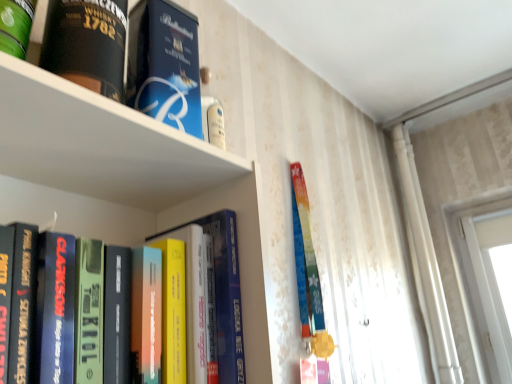
This screenshot has width=512, height=384. What do you see at coordinates (164, 65) in the screenshot? I see `blue cardboard box at upper center, positioned as the second book in bottom-to-top order` at bounding box center [164, 65].

Describe the element at coordinates (130, 56) in the screenshot. I see `black matte whiskey bottle at upper left, which is counted as the second book, starting from the top` at that location.

This screenshot has height=384, width=512. Describe the element at coordinates (16, 26) in the screenshot. I see `green matte canister at upper left, which appears as the 1th book when viewed from the top` at that location.

The width and height of the screenshot is (512, 384). Identify the location of green matte canister at upper left, which appears as the 1th book when viewed from the top. (16, 26).

Identify the location of blue cardboard box at upper center, placed as the third book when sorted from top to bottom. (164, 65).

Which object is closer to the camera, green matte canister at upper left, which is counted as the 4th book, starting from the bottom, or hardcover book at left, marked as the first book in a bottom-to-top arrangement?

hardcover book at left, marked as the first book in a bottom-to-top arrangement.

Between green matte canister at upper left, which appears as the 1th book when viewed from the top, and hardcover book at left, arranged as the fourth book when viewed from the top, which one has larger width?

Wider between the two is hardcover book at left, arranged as the fourth book when viewed from the top.

Visually, is green matte canister at upper left, which is counted as the 4th book, starting from the bottom, positioned to the left or to the right of hardcover book at left, marked as the first book in a bottom-to-top arrangement?

In the image, green matte canister at upper left, which is counted as the 4th book, starting from the bottom, appears on the left side of hardcover book at left, marked as the first book in a bottom-to-top arrangement.

Is green matte canister at upper left, which appears as the 1th book when viewed from the top, looking in the opposite direction of hardcover book at left, arranged as the fourth book when viewed from the top?

green matte canister at upper left, which appears as the 1th book when viewed from the top, does not have its back to hardcover book at left, arranged as the fourth book when viewed from the top.

Is blue cardboard box at upper center, positioned as the second book in bottom-to-top order, inside or outside of green matte canister at upper left, which appears as the 1th book when viewed from the top?

blue cardboard box at upper center, positioned as the second book in bottom-to-top order, is not inside green matte canister at upper left, which appears as the 1th book when viewed from the top, it's outside.

Who is taller, blue cardboard box at upper center, positioned as the second book in bottom-to-top order, or green matte canister at upper left, which appears as the 1th book when viewed from the top?

green matte canister at upper left, which appears as the 1th book when viewed from the top.

Would you say blue cardboard box at upper center, placed as the third book when sorted from top to bottom, is a long distance from green matte canister at upper left, which appears as the 1th book when viewed from the top?

They are positioned close to each other.

What's the angular difference between blue cardboard box at upper center, positioned as the second book in bottom-to-top order, and green matte canister at upper left, which is counted as the 4th book, starting from the bottom,'s facing directions?

2.79 degrees separate the facing orientations of blue cardboard box at upper center, positioned as the second book in bottom-to-top order, and green matte canister at upper left, which is counted as the 4th book, starting from the bottom.

From the image's perspective, count 3rd books downward from the green matte canister at upper left, which is counted as the 4th book, starting from the bottom, and point to it. Please provide its 2D coordinates.

[(89, 309)]

Which object is further away from the camera taking this photo, hardcover book at left, marked as the first book in a bottom-to-top arrangement, or green matte canister at upper left, which is counted as the 4th book, starting from the bottom?

Positioned behind is green matte canister at upper left, which is counted as the 4th book, starting from the bottom.

From a real-world perspective, who is located lower, hardcover book at left, arranged as the fourth book when viewed from the top, or green matte canister at upper left, which is counted as the 4th book, starting from the bottom?

From a 3D spatial view, hardcover book at left, arranged as the fourth book when viewed from the top, is below.

Based on the photo, from the image's perspective, relative to green matte canister at upper left, which appears as the 1th book when viewed from the top, is hardcover book at left, marked as the first book in a bottom-to-top arrangement, above or below?

Clearly, from the image's perspective, hardcover book at left, marked as the first book in a bottom-to-top arrangement, is below green matte canister at upper left, which appears as the 1th book when viewed from the top.

Does point (69, 240) appear closer or farther from the camera than point (176, 31)?

Clearly, point (69, 240) is closer to the camera than point (176, 31).

Could you tell me if hardcover book at left, arranged as the fourth book when viewed from the top, is facing blue cardboard box at upper center, placed as the third book when sorted from top to bottom?

No, hardcover book at left, arranged as the fourth book when viewed from the top, is not aimed at blue cardboard box at upper center, placed as the third book when sorted from top to bottom.

The image size is (512, 384). What are the coordinates of `book that is the 2nd one below the blue cardboard box at upper center, placed as the third book when sorted from top to bottom (from a real-world perspective)` in the screenshot? It's located at (89, 309).

Which is nearer, (1, 29) or (198, 70)?

Clearly, point (1, 29) is closer to the camera than point (198, 70).

From a real-world perspective, between green matte canister at upper left, which is counted as the 4th book, starting from the bottom, and blue cardboard box at upper center, placed as the third book when sorted from top to bottom, who is vertically lower?

From a 3D spatial view, blue cardboard box at upper center, placed as the third book when sorted from top to bottom, is below.

Is green matte canister at upper left, which appears as the 1th book when viewed from the top, shorter than blue cardboard box at upper center, placed as the third book when sorted from top to bottom?

No.

Considering their positions, is blue cardboard box at upper center, placed as the third book when sorted from top to bottom, located in front of or behind black matte whiskey bottle at upper left, which is the 3th book from bottom to top?

In the image, blue cardboard box at upper center, placed as the third book when sorted from top to bottom, appears behind black matte whiskey bottle at upper left, which is the 3th book from bottom to top.

Considering the sizes of blue cardboard box at upper center, positioned as the second book in bottom-to-top order, and black matte whiskey bottle at upper left, which is counted as the second book, starting from the top, in the image, is blue cardboard box at upper center, positioned as the second book in bottom-to-top order, bigger or smaller than black matte whiskey bottle at upper left, which is counted as the second book, starting from the top,?

blue cardboard box at upper center, positioned as the second book in bottom-to-top order, is smaller than black matte whiskey bottle at upper left, which is counted as the second book, starting from the top.

Based on the photo, between blue cardboard box at upper center, placed as the third book when sorted from top to bottom, and black matte whiskey bottle at upper left, which is counted as the second book, starting from the top, which one appears on the right side from the viewer's perspective?

blue cardboard box at upper center, placed as the third book when sorted from top to bottom.

Does blue cardboard box at upper center, placed as the third book when sorted from top to bottom, have a lesser width compared to black matte whiskey bottle at upper left, which is the 3th book from bottom to top?

Yes, blue cardboard box at upper center, placed as the third book when sorted from top to bottom, is thinner than black matte whiskey bottle at upper left, which is the 3th book from bottom to top.

Which object is further away from the camera taking this photo, green matte canister at upper left, which appears as the 1th book when viewed from the top, or black matte whiskey bottle at upper left, which is counted as the second book, starting from the top?

black matte whiskey bottle at upper left, which is counted as the second book, starting from the top, is behind.

Is green matte canister at upper left, which is counted as the 4th book, starting from the bottom, positioned with its back to black matte whiskey bottle at upper left, which is counted as the second book, starting from the top?

No, green matte canister at upper left, which is counted as the 4th book, starting from the bottom, is not facing the opposite direction of black matte whiskey bottle at upper left, which is counted as the second book, starting from the top.

Is green matte canister at upper left, which is counted as the 4th book, starting from the bottom, completely or partially outside of black matte whiskey bottle at upper left, which is the 3th book from bottom to top?

Yes, green matte canister at upper left, which is counted as the 4th book, starting from the bottom, is located beyond the bounds of black matte whiskey bottle at upper left, which is the 3th book from bottom to top.

Considering the relative sizes of green matte canister at upper left, which is counted as the 4th book, starting from the bottom, and black matte whiskey bottle at upper left, which is counted as the second book, starting from the top, in the image provided, is green matte canister at upper left, which is counted as the 4th book, starting from the bottom, wider than black matte whiskey bottle at upper left, which is counted as the second book, starting from the top,?

No.

Identify the location of book that is the 2nd object to the right of the green matte canister at upper left, which appears as the 1th book when viewed from the top, starting at the anchor. (89, 309).

There is a blue cardboard box at upper center, positioned as the second book in bottom-to-top order. What are the coordinates of `the 2nd book above it (from the image's perspective)` in the screenshot? It's located at (16, 26).

Estimate the real-world distances between objects in this image. Which object is closer to black matte whiskey bottle at upper left, which is counted as the second book, starting from the top, blue cardboard box at upper center, placed as the third book when sorted from top to bottom, or green matte canister at upper left, which is counted as the 4th book, starting from the bottom?

The object closer to black matte whiskey bottle at upper left, which is counted as the second book, starting from the top, is blue cardboard box at upper center, placed as the third book when sorted from top to bottom.

From the image, which object appears to be nearer to hardcover book at left, arranged as the fourth book when viewed from the top, green matte canister at upper left, which appears as the 1th book when viewed from the top, or black matte whiskey bottle at upper left, which is counted as the second book, starting from the top?

Among the two, black matte whiskey bottle at upper left, which is counted as the second book, starting from the top, is located nearer to hardcover book at left, arranged as the fourth book when viewed from the top.

When comparing their distances from blue cardboard box at upper center, positioned as the second book in bottom-to-top order, does black matte whiskey bottle at upper left, which is counted as the second book, starting from the top, or green matte canister at upper left, which is counted as the 4th book, starting from the bottom, seem further?

green matte canister at upper left, which is counted as the 4th book, starting from the bottom, is further to blue cardboard box at upper center, positioned as the second book in bottom-to-top order.

From the image, which object appears to be nearer to hardcover book at left, marked as the first book in a bottom-to-top arrangement, black matte whiskey bottle at upper left, which is counted as the second book, starting from the top, or green matte canister at upper left, which is counted as the 4th book, starting from the bottom?

black matte whiskey bottle at upper left, which is counted as the second book, starting from the top, lies closer to hardcover book at left, marked as the first book in a bottom-to-top arrangement, than the other object.

Based on their spatial positions, is green matte canister at upper left, which appears as the 1th book when viewed from the top, or blue cardboard box at upper center, placed as the third book when sorted from top to bottom, further from black matte whiskey bottle at upper left, which is the 3th book from bottom to top?

The object further to black matte whiskey bottle at upper left, which is the 3th book from bottom to top, is green matte canister at upper left, which appears as the 1th book when viewed from the top.

From the image, which object appears to be farther from hardcover book at left, marked as the first book in a bottom-to-top arrangement, blue cardboard box at upper center, placed as the third book when sorted from top to bottom, or black matte whiskey bottle at upper left, which is counted as the second book, starting from the top?

Among the two, black matte whiskey bottle at upper left, which is counted as the second book, starting from the top, is located further to hardcover book at left, marked as the first book in a bottom-to-top arrangement.

Estimate the real-world distances between objects in this image. Which object is closer to green matte canister at upper left, which appears as the 1th book when viewed from the top, hardcover book at left, arranged as the fourth book when viewed from the top, or blue cardboard box at upper center, placed as the third book when sorted from top to bottom?

Based on the image, blue cardboard box at upper center, placed as the third book when sorted from top to bottom, appears to be nearer to green matte canister at upper left, which appears as the 1th book when viewed from the top.

When comparing their distances from hardcover book at left, marked as the first book in a bottom-to-top arrangement, does green matte canister at upper left, which appears as the 1th book when viewed from the top, or blue cardboard box at upper center, positioned as the second book in bottom-to-top order, seem further?

green matte canister at upper left, which appears as the 1th book when viewed from the top, is further to hardcover book at left, marked as the first book in a bottom-to-top arrangement.

Locate an element on the screen. This screenshot has height=384, width=512. book between black matte whiskey bottle at upper left, which is counted as the second book, starting from the top, and hardcover book at left, marked as the first book in a bottom-to-top arrangement, in the up-down direction is located at coordinates (164, 65).